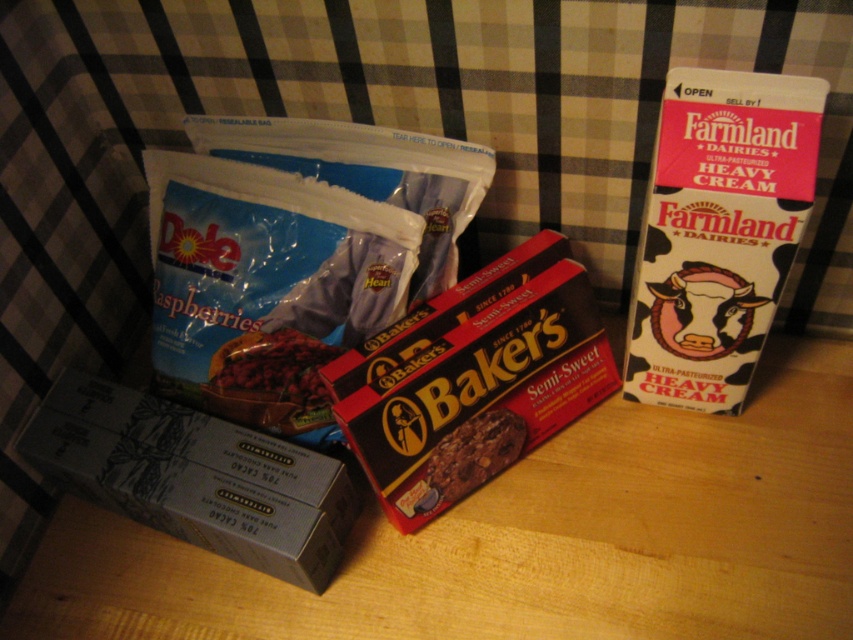
Question: Where is matte gray box of chocolate at lower left located in relation to matte brown chocolate bar at center in the image?

Choices:
 (A) below
 (B) above

Answer: (A)

Question: Which object is the closest to the matte brown chocolate bar at center?

Choices:
 (A) matte gray box of chocolate at lower left
 (B) matte black chocolate bar at center
 (C) chocolate-coated cookie at center
 (D) semi-glossy cardboard box of baker's semi-sweet chocolate chips at center

Answer: (B)

Question: Which of the following is the farthest from the observer?

Choices:
 (A) matte gray box of chocolate at lower left
 (B) matte brown chocolate bar at center
 (C) chocolate-coated cookie at center
 (D) semi-glossy cardboard box of baker's semi-sweet chocolate chips at center

Answer: (B)

Question: Which point is closer to the camera?

Choices:
 (A) (474, 426)
 (B) (308, 241)
 (C) (466, 385)
 (D) (809, 97)

Answer: (D)

Question: Is white cardboard box at right bigger than chocolate-coated cookie at center?

Choices:
 (A) yes
 (B) no

Answer: (A)

Question: Is semi-glossy cardboard box of baker's semi-sweet chocolate chips at center smaller than chocolate-coated cookie at center?

Choices:
 (A) no
 (B) yes

Answer: (A)